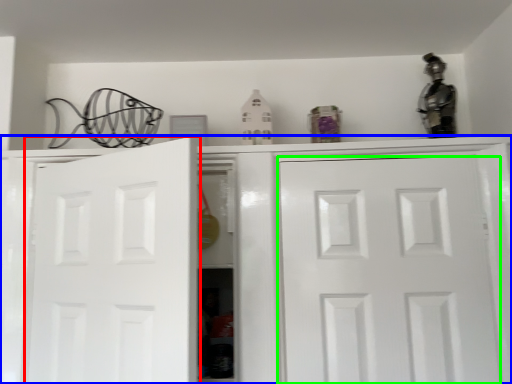
Question: Considering the real-world distances, which object is closest to door (highlighted by a red box)? cabinetry (highlighted by a blue box) or door (highlighted by a green box).

Choices:
 (A) cabinetry
 (B) door

Answer: (A)